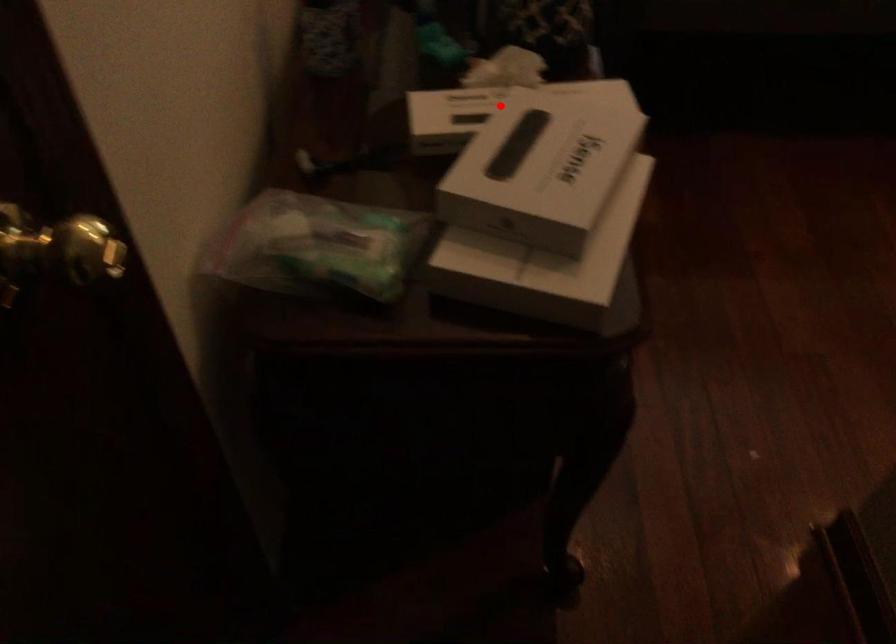
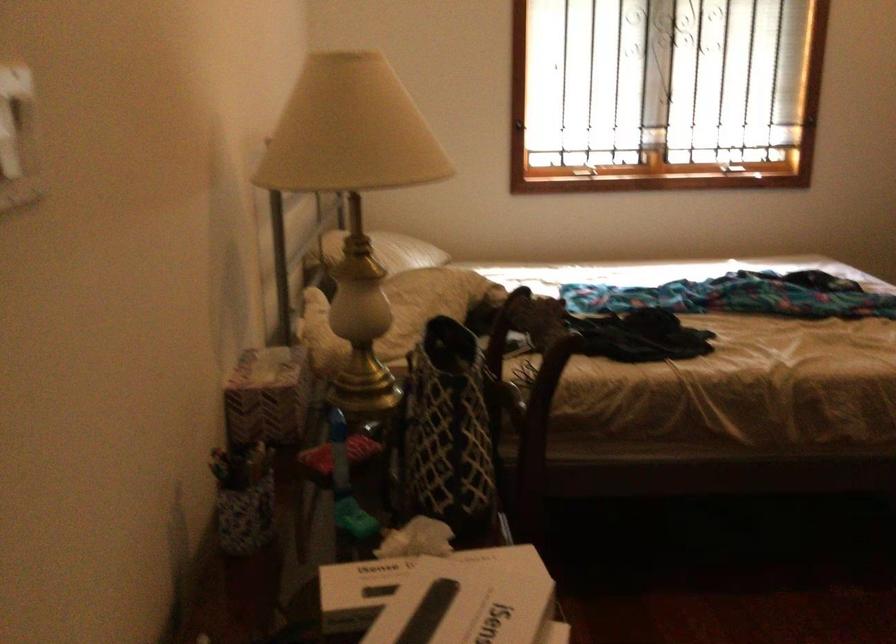
Where in the second image is the point corresponding to the highlighted location from the first image?

(407, 583)